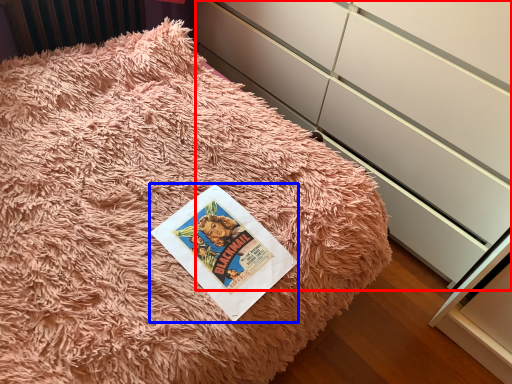
Question: Which object is further to the camera taking this photo, cabinetry (highlighted by a red box) or paperback book (highlighted by a blue box)?

Choices:
 (A) cabinetry
 (B) paperback book

Answer: (B)